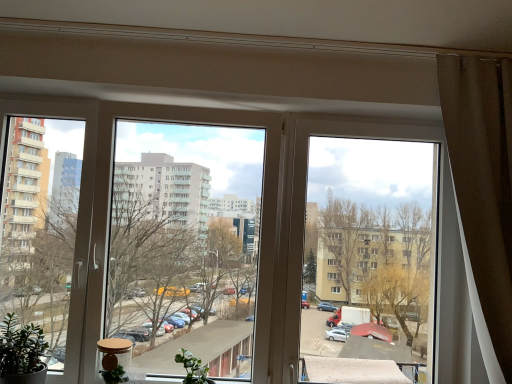
Image resolution: width=512 pixels, height=384 pixels. What are the coordinates of `vacant space situated above transparent plastic window at center, the 1th window when ordered from left to right (from a real-world perspective)` in the screenshot? It's located at (138, 97).